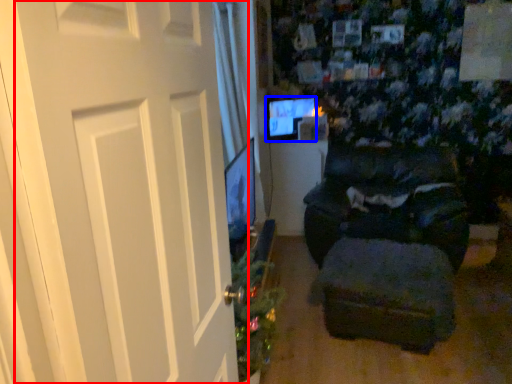
Question: Which of the following is the closest to the observer, door (highlighted by a red box) or computer monitor (highlighted by a blue box)?

Choices:
 (A) door
 (B) computer monitor

Answer: (A)